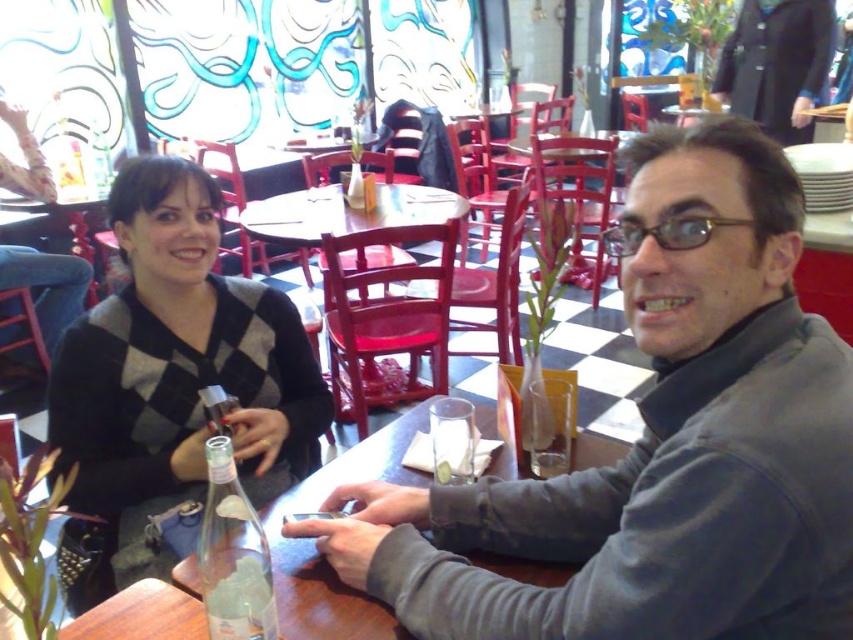
Which is above, black knit sweater at upper left or clear glass bottle at table center?

black knit sweater at upper left is higher up.

Can you confirm if black knit sweater at upper left is shorter than clear glass bottle at table center?

No, black knit sweater at upper left is not shorter than clear glass bottle at table center.

Image resolution: width=853 pixels, height=640 pixels. Find the location of `black knit sweater at upper left`. black knit sweater at upper left is located at coordinates (175, 376).

The height and width of the screenshot is (640, 853). Find the location of `black knit sweater at upper left`. black knit sweater at upper left is located at coordinates (175, 376).

Is gray matte jacket at center to the right of black knit sweater at upper left from the viewer's perspective?

Indeed, gray matte jacket at center is positioned on the right side of black knit sweater at upper left.

Who is more forward, (x=627, y=493) or (x=202, y=276)?

Point (x=627, y=493) is more forward.

Image resolution: width=853 pixels, height=640 pixels. I want to click on gray matte jacket at center, so click(659, 444).

Which is more to the right, gray matte jacket at center or wooden round table at center?

gray matte jacket at center is more to the right.

Is the position of gray matte jacket at center more distant than that of wooden round table at center?

No.

This screenshot has height=640, width=853. What do you see at coordinates (659, 444) in the screenshot?
I see `gray matte jacket at center` at bounding box center [659, 444].

At what (x,y) coordinates should I click in order to perform the action: click on gray matte jacket at center. Please return your answer as a coordinate pair (x, y). This screenshot has width=853, height=640. Looking at the image, I should click on (659, 444).